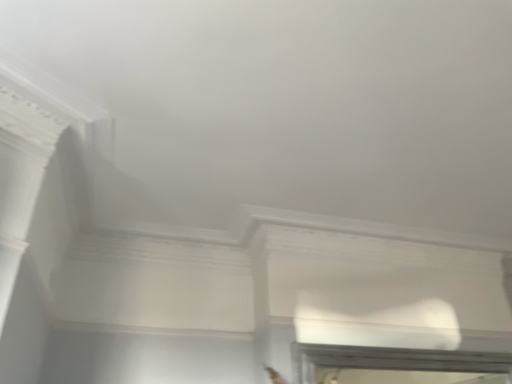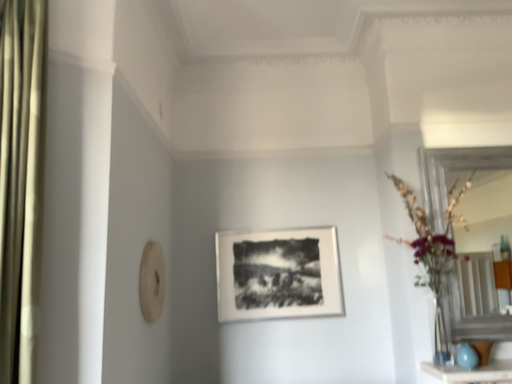
Question: Which way did the camera rotate in the video?

Choices:
 (A) rotated upward
 (B) rotated downward

Answer: (B)